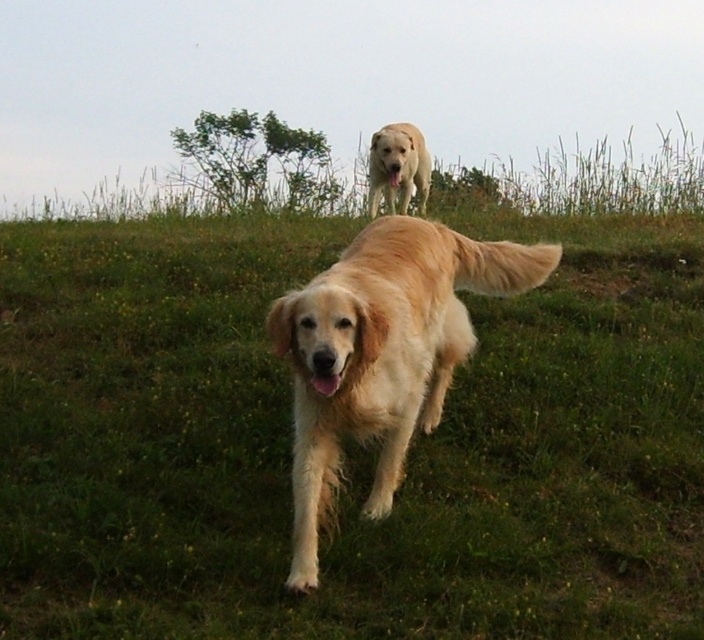
Question: Does golden soft fur dog at center have a larger size compared to golden fur dog at upper center?

Choices:
 (A) yes
 (B) no

Answer: (A)

Question: Does golden soft fur dog at center appear on the right side of golden fur dog at upper center?

Choices:
 (A) no
 (B) yes

Answer: (A)

Question: Among these points, which one is farthest from the camera?

Choices:
 (A) (398, 172)
 (B) (310, 470)

Answer: (A)

Question: Is golden soft fur dog at center bigger than golden fur dog at upper center?

Choices:
 (A) no
 (B) yes

Answer: (B)